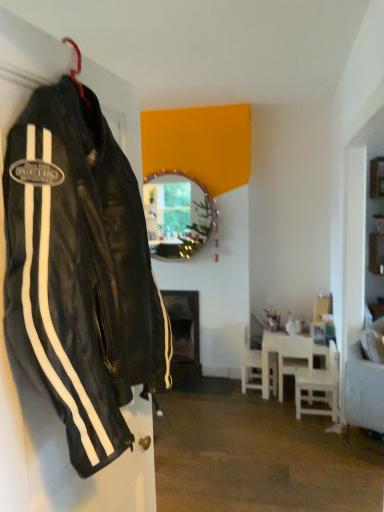
Question: Relative to black leather jacket at left, is white plastic chair at lower right, arranged as the 1th chair when viewed from the back, in front or behind?

Choices:
 (A) behind
 (B) front

Answer: (A)

Question: From a real-world perspective, is white plastic chair at lower right, which appears as the third chair when viewed from the front, positioned above or below black leather jacket at left?

Choices:
 (A) above
 (B) below

Answer: (B)

Question: Which of these objects is positioned closest to the shiny metallic mirror at center?

Choices:
 (A) white wooden table at lower right
 (B) white plastic chair at lower right, which appears as the first chair when viewed from the front
 (C) black leather jacket at left
 (D) white plastic chair at lower right, arranged as the 1th chair when viewed from the back
 (E) white wooden chair at lower right, which is the second chair in front-to-back order

Answer: (A)

Question: Based on their relative distances, which object is nearer to the white plastic chair at lower right, arranged as the 1th chair when viewed from the back?

Choices:
 (A) black leather jacket at left
 (B) white wooden table at lower right
 (C) shiny metallic mirror at center
 (D) white plastic chair at lower right, arranged as the third chair when viewed from the back
 (E) white wooden chair at lower right, positioned as the 2th chair in back-to-front order

Answer: (B)